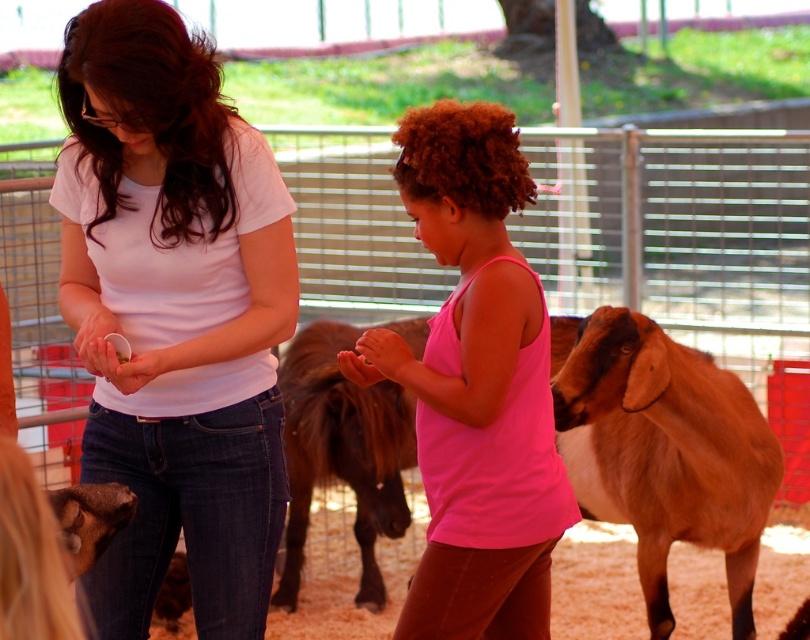
Does matte white shirt at center have a greater width compared to brown woolen goat at right?

No.

Who is more forward, (x=186, y=202) or (x=753, y=636)?

Positioned in front is point (x=186, y=202).

What do you see at coordinates (173, 314) in the screenshot? This screenshot has width=810, height=640. I see `matte white shirt at center` at bounding box center [173, 314].

Identify the location of matte white shirt at center. (173, 314).

Does pink matte tank top at center appear on the right side of brown fuzzy pony at center?

Yes, pink matte tank top at center is to the right of brown fuzzy pony at center.

You are a GUI agent. You are given a task and a screenshot of the screen. Output one action in this format:
    pyautogui.click(x=<x>, y=<y>)
    Task: Click on the pink matte tank top at center
    The width and height of the screenshot is (810, 640).
    Given the screenshot: What is the action you would take?
    pyautogui.click(x=475, y=385)

You are a GUI agent. You are given a task and a screenshot of the screen. Output one action in this format:
    pyautogui.click(x=<x>, y=<y>)
    Task: Click on the pink matte tank top at center
    
    Given the screenshot: What is the action you would take?
    pyautogui.click(x=475, y=385)

Is matte white shirt at center to the left of brown fuzzy pony at center from the viewer's perspective?

Yes, matte white shirt at center is to the left of brown fuzzy pony at center.

Locate an element on the screen. matte white shirt at center is located at coordinates (173, 314).